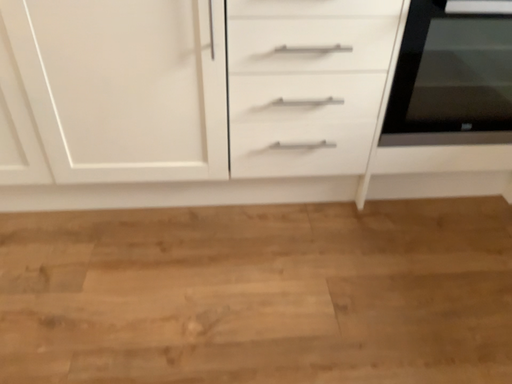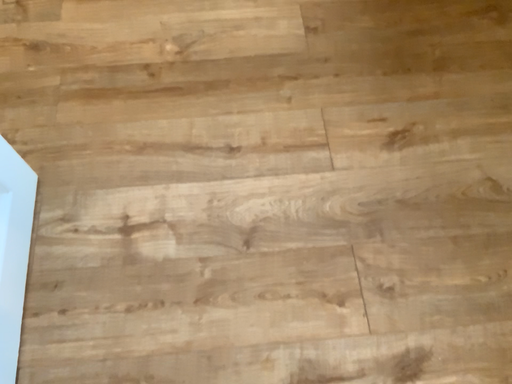
Question: How did the camera likely rotate when shooting the video?

Choices:
 (A) rotated downward
 (B) rotated upward

Answer: (A)